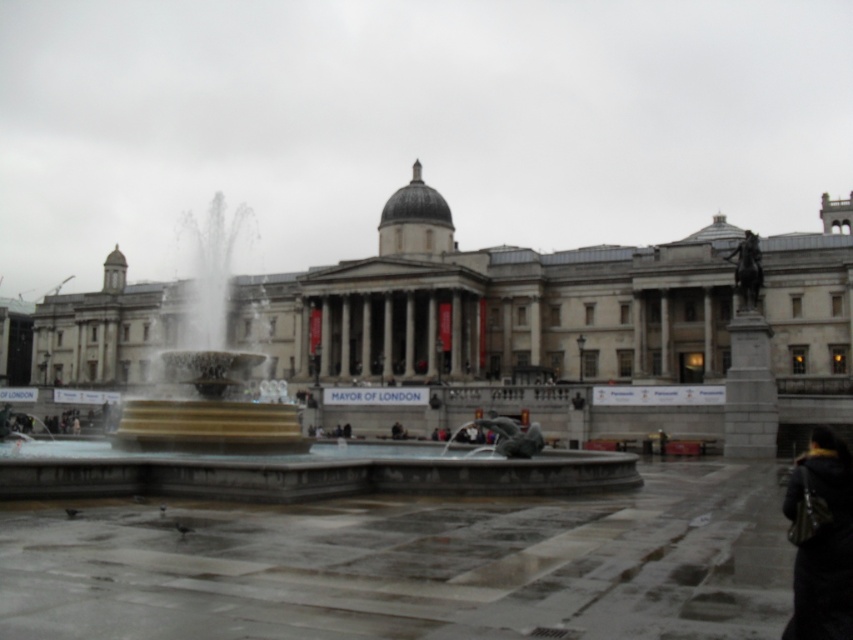
Is silver metallic fountain at center closer to camera compared to black leather jacket at lower right?

No, silver metallic fountain at center is behind black leather jacket at lower right.

Who is more distant from viewer, (212, 262) or (811, 476)?

Positioned behind is point (212, 262).

The height and width of the screenshot is (640, 853). What are the coordinates of `silver metallic fountain at center` in the screenshot? It's located at (209, 371).

Which of these two, silver metallic fountain at center or gray stone statue at right, stands shorter?

gray stone statue at right is shorter.

Is point (231, 397) closer to viewer compared to point (772, 376)?

That is True.

Who is more forward, (224, 440) or (732, 400)?

Point (224, 440)

Image resolution: width=853 pixels, height=640 pixels. In order to click on silver metallic fountain at center in this screenshot , I will do `click(209, 371)`.

Between stone fountain at center and silver metallic fountain at center, which one is positioned higher?

stone fountain at center is above.

In order to click on stone fountain at center in this screenshot , I will do `click(270, 449)`.